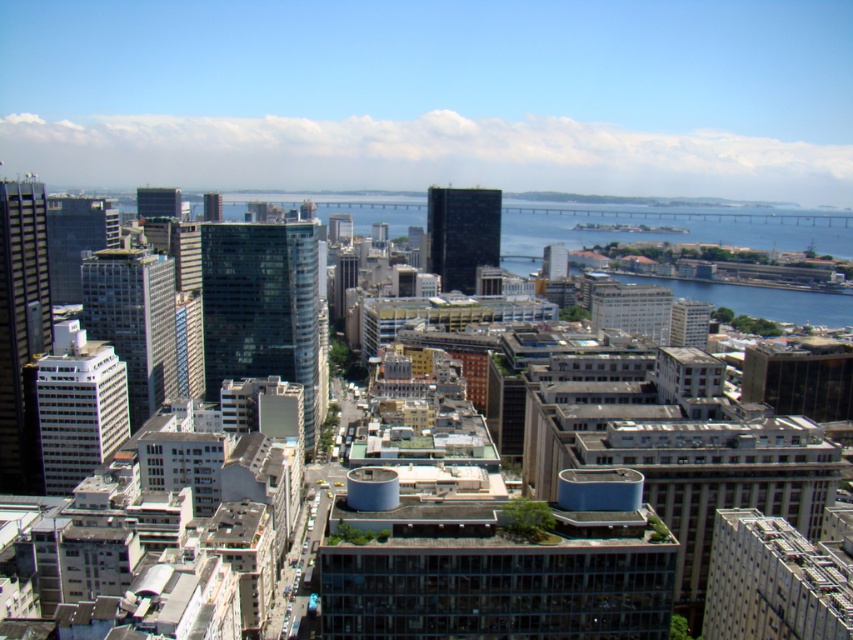
Does transparent glass water at center appear on the left side of glassy blue skyscraper at upper center?

In fact, transparent glass water at center is to the right of glassy blue skyscraper at upper center.

What do you see at coordinates (653, 230) in the screenshot? I see `transparent glass water at center` at bounding box center [653, 230].

The width and height of the screenshot is (853, 640). I want to click on transparent glass water at center, so click(x=653, y=230).

Does matte glass tower at upper left appear under glassy blue skyscraper at upper center?

Yes.

Which is above, matte glass tower at upper left or glassy blue skyscraper at upper center?

glassy blue skyscraper at upper center is above.

The height and width of the screenshot is (640, 853). In order to click on matte glass tower at upper left in this screenshot , I will do `click(158, 202)`.

Between point (119, 406) and point (567, 253), which one is positioned in front?

Point (119, 406)

Does white glossy building at left come in front of matte glass skyscraper at center?

Yes, white glossy building at left is closer to the viewer.

You are a GUI agent. You are given a task and a screenshot of the screen. Output one action in this format:
    pyautogui.click(x=<x>, y=<y>)
    Task: Click on the white glossy building at left
    The image size is (853, 640).
    Given the screenshot: What is the action you would take?
    pyautogui.click(x=78, y=404)

Image resolution: width=853 pixels, height=640 pixels. Find the location of `white glossy building at left`. white glossy building at left is located at coordinates (78, 404).